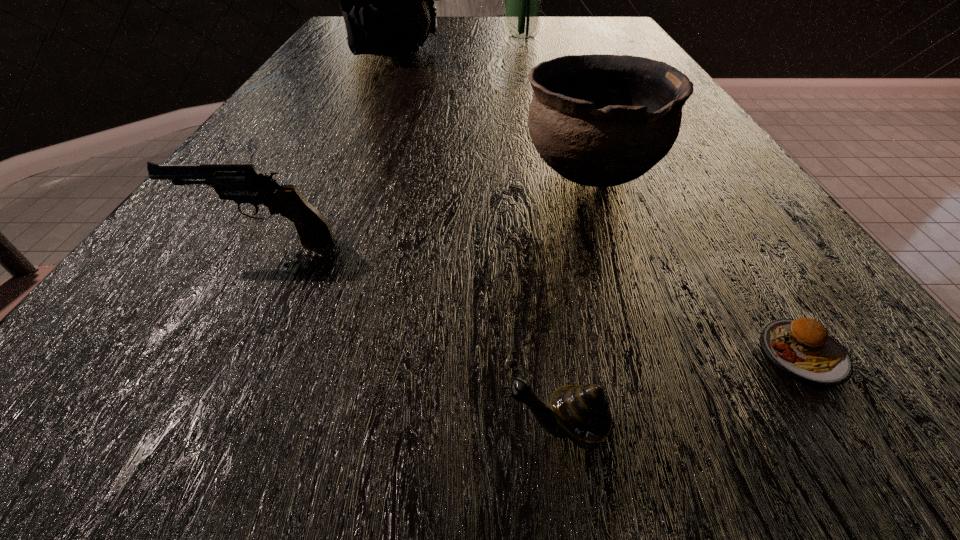
In order to click on empty space between the second nearest object and the gun in this screenshot , I will do `click(533, 298)`.

Identify the location of unoccupied area between the shoulder bag and the fifth tallest object. The width and height of the screenshot is (960, 540). (476, 239).

Where is `empty space that is in between the pottery and the snail`? The width and height of the screenshot is (960, 540). empty space that is in between the pottery and the snail is located at coordinates (575, 299).

Where is `unoccupied area between the fourth farthest object and the shortest object`? The width and height of the screenshot is (960, 540). unoccupied area between the fourth farthest object and the shortest object is located at coordinates (533, 298).

Where is `object that is the second closest one to the bouquet`? The height and width of the screenshot is (540, 960). object that is the second closest one to the bouquet is located at coordinates (597, 120).

You are a GUI agent. You are given a task and a screenshot of the screen. Output one action in this format:
    pyautogui.click(x=<x>, y=<y>)
    Task: Click on the closest object to the shoulder bag
    The height and width of the screenshot is (540, 960).
    Given the screenshot: What is the action you would take?
    pyautogui.click(x=523, y=0)

Find the location of a particular element. Image resolution: width=960 pixels, height=540 pixels. vacant region that satisfies the following two spatial constraints: 1. on the open flap of the second nearest object; 2. on the right side of the fifth shortest object is located at coordinates (263, 353).

Identify the location of free space that satisfies the following two spatial constraints: 1. on the front-facing side of the fourth nearest object; 2. on the left side of the bouquet. (550, 170).

This screenshot has height=540, width=960. What are the coordinates of `vacant region that satisfies the following two spatial constraints: 1. on the open flap of the second nearest object; 2. on the left side of the second tallest object` in the screenshot? It's located at (263, 353).

Where is `free point that satisfies the following two spatial constraints: 1. on the back side of the shortest object; 2. on the open flap of the shoulder bag`? free point that satisfies the following two spatial constraints: 1. on the back side of the shortest object; 2. on the open flap of the shoulder bag is located at coordinates (609, 50).